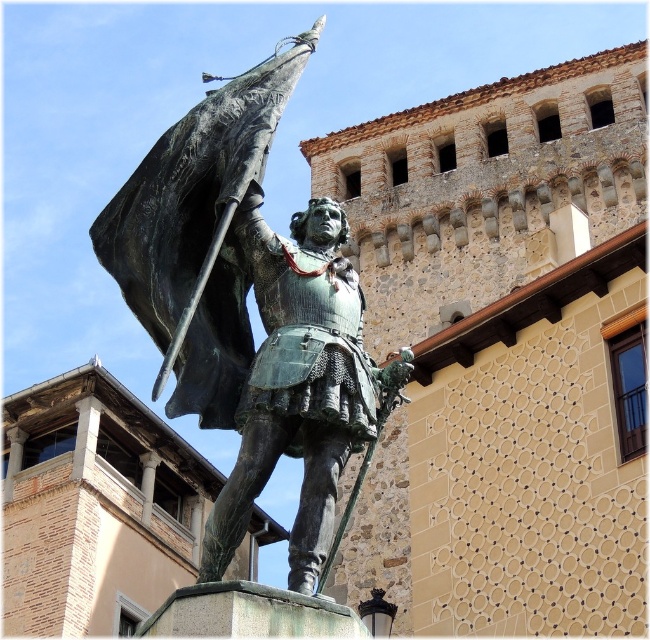
In the scene shown: You are an art conservator assessing the bronze statue at center and the green patina armor at center. Which object has a greater width?

The bronze statue at center has a greater width than the green patina armor at center.

You are an art student analyzing the statue in the scene. You notice the bronze statue at center and the green patina armor at center. Which object is taller?

The bronze statue at center is much taller than the green patina armor at center.